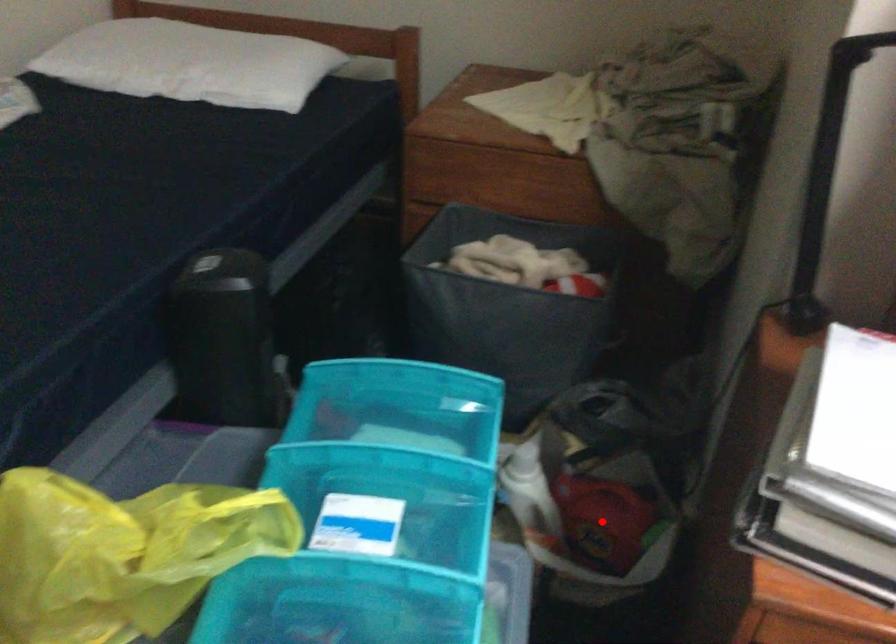
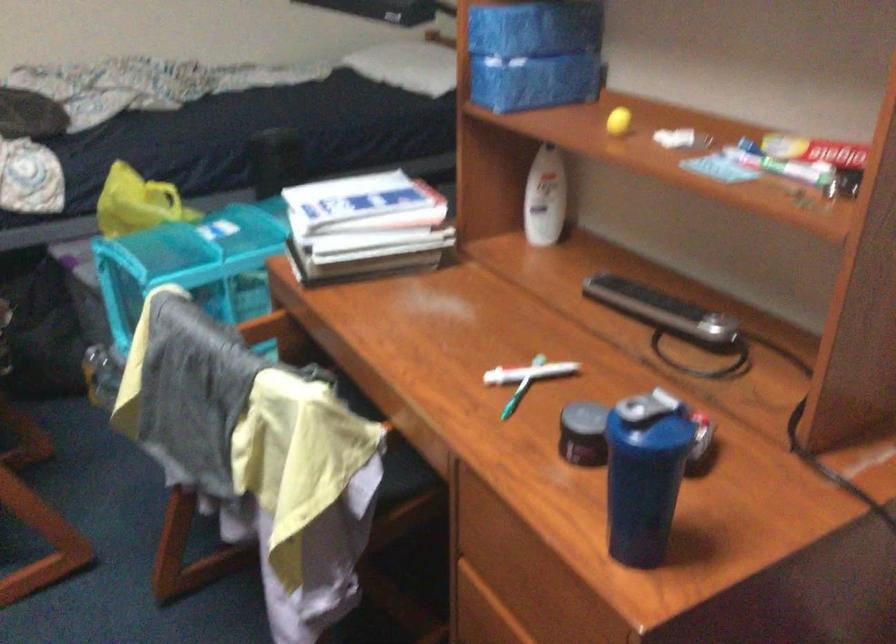
Question: I am providing you with two images of the same scene from different viewpoints. A red point is marked on the first image. Can you still see the location of the red point in image 2?

Choices:
 (A) Yes
 (B) No

Answer: (B)